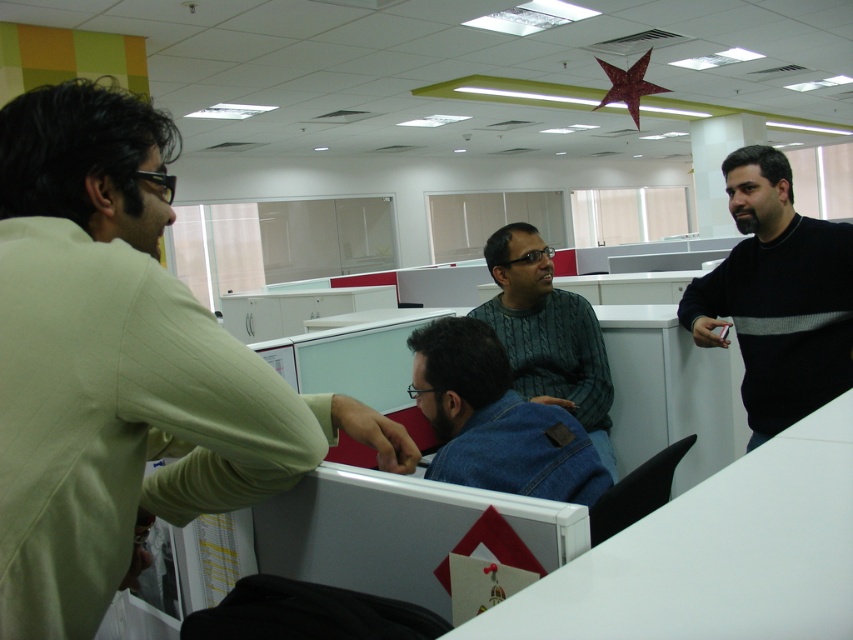
You are an office worker who needs to borrow a jacket from either the black sweater at right or the denim jacket at center. Which jacket is closer to your current position if you are standing at the center of the office?

The denim jacket at center is closer to your current position since it is located at the center of the office, while the black sweater at right is positioned to the right side of it.

You are standing in the office and see the light beige shirt at left. Can you estimate its position relative to the center of the room?

The light beige shirt at left is located at point 0.575 on the x axis and 0.143 on the y axis, which places it to the left and slightly below the center of the room.

In the office scene, there are two people wearing a denim jacket at center and a green knitted sweater at center. Which one is positioned to the left?

The denim jacket at center is to the left of the green knitted sweater at center.